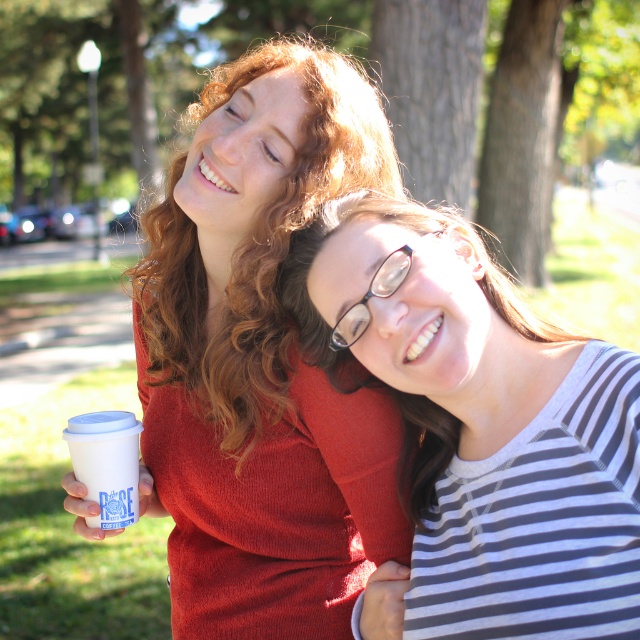
Who is positioned more to the left, striped fabric shirt at center or white paper cup at left?

Positioned to the left is white paper cup at left.

Who is more forward, (524, 518) or (76, 416)?

Positioned in front is point (524, 518).

Between point (602, 451) and point (118, 452), which one is positioned in front?

Point (602, 451)

The image size is (640, 640). I want to click on striped fabric shirt at center, so click(x=477, y=428).

Who is higher up, matte red sweater at upper center or green textured bark at upper center?

green textured bark at upper center is above.

Can you confirm if matte red sweater at upper center is taller than green textured bark at upper center?

No, matte red sweater at upper center is not taller than green textured bark at upper center.

Which is in front, point (342, 435) or point (403, 93)?

Positioned in front is point (342, 435).

Identify the location of matte red sweater at upper center. (260, 360).

Between point (321, 582) and point (3, 113), which one is positioned behind?

The point (3, 113) is more distant.

Who is more distant from viewer, (330,157) or (595,138)?

The point (595,138) is more distant.

In order to click on matte red sweater at upper center in this screenshot , I will do `click(260, 360)`.